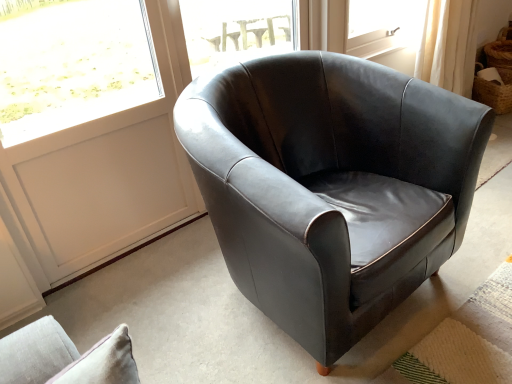
Describe the element at coordinates (105, 175) in the screenshot. I see `white panel at upper left` at that location.

What is the approximate width of white panel at upper left?

The width of white panel at upper left is 2.55 inches.

Image resolution: width=512 pixels, height=384 pixels. In order to click on matte black armchair at center in this screenshot , I will do `click(331, 186)`.

Is there a large distance between white panel at upper left and transparent glass window at center?

They are positioned close to each other.

Is white panel at upper left shorter than transparent glass window at center?

In fact, white panel at upper left may be taller than transparent glass window at center.

Is point (80, 205) closer or farther from the camera than point (228, 18)?

Point (80, 205) is positioned closer to the camera compared to point (228, 18).

Who is bigger, white panel at upper left or transparent glass window at center?

Bigger between the two is white panel at upper left.

Based on their positions, is woven brown basket at upper right located to the left or right of white panel at upper left?

From the image, it's evident that woven brown basket at upper right is to the right of white panel at upper left.

Is woven brown basket at upper right in contact with white panel at upper left?

They are not placed beside each other.

Can you tell me how much woven brown basket at upper right and white panel at upper left differ in facing direction?

woven brown basket at upper right and white panel at upper left are facing 36.5 degrees away from each other.

Which point is more forward, (447, 222) or (509, 89)?

The point (447, 222) is closer.

Consider the image. Which is more to the right, matte black armchair at center or woven brown basket at upper right?

woven brown basket at upper right is more to the right.

From the image's perspective, relative to woven brown basket at upper right, is matte black armchair at center above or below?

From the image's perspective, matte black armchair at center appears below woven brown basket at upper right.

Between matte black armchair at center and woven brown basket at upper right, which one has less height?

woven brown basket at upper right is shorter.

Does point (198, 126) appear closer or farther from the camera than point (234, 24)?

Point (198, 126) is positioned closer to the camera compared to point (234, 24).

Do you think matte black armchair at center is within transparent glass window at center, or outside of it?

matte black armchair at center is located beyond the bounds of transparent glass window at center.

In the scene shown: Which object is closer to the camera taking this photo, matte black armchair at center or transparent glass window at center?

Positioned in front is matte black armchair at center.

Could you tell me if matte black armchair at center is facing transparent glass window at center?

No, matte black armchair at center is not facing towards transparent glass window at center.

Consider the image. Is white panel at upper left bigger than woven brown basket at upper right?

Yes.

From the image's perspective, is white panel at upper left over woven brown basket at upper right?

No, from the image's perspective, white panel at upper left is not over woven brown basket at upper right.

Looking at their sizes, would you say white panel at upper left is wider or thinner than woven brown basket at upper right?

Clearly, white panel at upper left has less width compared to woven brown basket at upper right.

Image resolution: width=512 pixels, height=384 pixels. I want to click on screen door lying on the left of woven brown basket at upper right, so click(x=105, y=175).

Considering the sizes of objects transparent glass window at center and matte black armchair at center in the image provided, who is taller, transparent glass window at center or matte black armchair at center?

matte black armchair at center is taller.

In the scene shown: Who is smaller, transparent glass window at center or matte black armchair at center?

With smaller size is transparent glass window at center.

Which object is closer to the camera taking this photo, transparent glass window at center or matte black armchair at center?

matte black armchair at center is more forward.

From the image's perspective, which is above, transparent glass window at center or matte black armchair at center?

transparent glass window at center, from the image's perspective.

Measure the distance between transparent glass window at center and white panel at upper left.

20.00 inches.

Is transparent glass window at center oriented towards white panel at upper left?

No, transparent glass window at center is not facing towards white panel at upper left.

Do you think transparent glass window at center is within white panel at upper left, or outside of it?

transparent glass window at center is located beyond the bounds of white panel at upper left.

Between point (243, 18) and point (133, 157), which one is positioned behind?

The point (243, 18) is behind.

Where is `window above the white panel at upper left (from the image's perspective)`? This screenshot has width=512, height=384. window above the white panel at upper left (from the image's perspective) is located at coordinates (236, 30).

The width and height of the screenshot is (512, 384). I want to click on screen door in front of the woven brown basket at upper right, so click(105, 175).

Considering their positions, is white panel at upper left positioned closer to woven brown basket at upper right than matte black armchair at center?

matte black armchair at center is closer to woven brown basket at upper right.

Considering their positions, is woven brown basket at upper right positioned further to transparent glass window at center than white panel at upper left?

Based on the image, woven brown basket at upper right appears to be further to transparent glass window at center.

Based on their spatial positions, is woven brown basket at upper right or transparent glass window at center further from white panel at upper left?

woven brown basket at upper right is positioned further to the anchor white panel at upper left.

Which object lies further to the anchor point transparent glass window at center, matte black armchair at center or woven brown basket at upper right?

woven brown basket at upper right lies further to transparent glass window at center than the other object.

Considering their positions, is woven brown basket at upper right positioned closer to matte black armchair at center than transparent glass window at center?

transparent glass window at center lies closer to matte black armchair at center than the other object.

Looking at the image, which one is located closer to matte black armchair at center, white panel at upper left or transparent glass window at center?

The object closer to matte black armchair at center is white panel at upper left.

Based on the photo, when comparing their distances from transparent glass window at center, does white panel at upper left or matte black armchair at center seem further?

matte black armchair at center is further to transparent glass window at center.

Estimate the real-world distances between objects in this image. Which object is closer to matte black armchair at center, transparent glass window at center or woven brown basket at upper right?

The object closer to matte black armchair at center is transparent glass window at center.

You are a GUI agent. You are given a task and a screenshot of the screen. Output one action in this format:
    pyautogui.click(x=<x>, y=<y>)
    Task: Click on the window between matte black armchair at center and woven brown basket at upper right from front to back
    The height and width of the screenshot is (384, 512).
    Given the screenshot: What is the action you would take?
    click(x=236, y=30)

Locate an element on the screen. chair between white panel at upper left and woven brown basket at upper right in the horizontal direction is located at coordinates (331, 186).

The height and width of the screenshot is (384, 512). Find the location of `window between white panel at upper left and woven brown basket at upper right in the horizontal direction`. window between white panel at upper left and woven brown basket at upper right in the horizontal direction is located at coordinates (236, 30).

At what (x,y) coordinates should I click in order to perform the action: click on window located between white panel at upper left and matte black armchair at center in the left-right direction. Please return your answer as a coordinate pair (x, y). The height and width of the screenshot is (384, 512). Looking at the image, I should click on (236, 30).